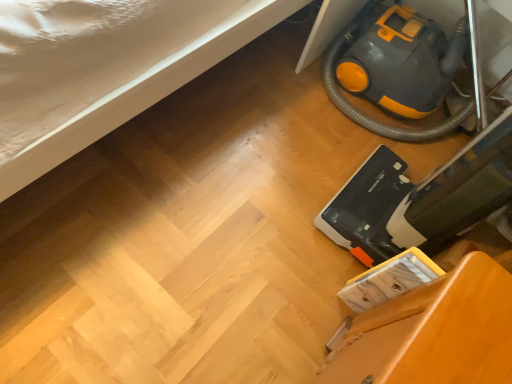
Where is `yellow-orange plastic vacuum cleaner at lower right, placed as the 1th equipment when sorted from back to front`? This screenshot has height=384, width=512. yellow-orange plastic vacuum cleaner at lower right, placed as the 1th equipment when sorted from back to front is located at coordinates (367, 115).

Identify the location of yellow-orange plastic vacuum cleaner at lower right, the first equipment viewed from the front. Image resolution: width=512 pixels, height=384 pixels. coord(420,198).

Is yellow-orange plastic vacuum cleaner at lower right, which is counted as the second equipment, starting from the front, turned away from wooden chair at lower right?

yellow-orange plastic vacuum cleaner at lower right, which is counted as the second equipment, starting from the front, does not have its back to wooden chair at lower right.

Would you say yellow-orange plastic vacuum cleaner at lower right, which is counted as the second equipment, starting from the front, is outside wooden chair at lower right?

yellow-orange plastic vacuum cleaner at lower right, which is counted as the second equipment, starting from the front, lies outside wooden chair at lower right's area.

Between yellow-orange plastic vacuum cleaner at lower right, placed as the 1th equipment when sorted from back to front, and wooden chair at lower right, which one has more height?

wooden chair at lower right is taller.

Is yellow-orange plastic vacuum cleaner at lower right, which is counted as the second equipment, starting from the front, to the left of wooden chair at lower right from the viewer's perspective?

Incorrect, yellow-orange plastic vacuum cleaner at lower right, which is counted as the second equipment, starting from the front, is not on the left side of wooden chair at lower right.

From the image's perspective, between yellow-orange plastic vacuum cleaner at lower right, the first equipment viewed from the front, and wooden chair at lower right, who is located below?

wooden chair at lower right.

Which of these two, yellow-orange plastic vacuum cleaner at lower right, the first equipment viewed from the front, or wooden chair at lower right, stands taller?

yellow-orange plastic vacuum cleaner at lower right, the first equipment viewed from the front.

Is yellow-orange plastic vacuum cleaner at lower right, the first equipment viewed from the front, aimed at wooden chair at lower right?

No, yellow-orange plastic vacuum cleaner at lower right, the first equipment viewed from the front, is not aimed at wooden chair at lower right.

From the image's perspective, count 1st equipments upward from the wooden chair at lower right and point to it. Please provide its 2D coordinates.

[(420, 198)]

Is yellow-orange plastic vacuum cleaner at lower right, the first equipment viewed from the front, placed right next to yellow-orange plastic vacuum cleaner at lower right, placed as the 1th equipment when sorted from back to front?

yellow-orange plastic vacuum cleaner at lower right, the first equipment viewed from the front, is not next to yellow-orange plastic vacuum cleaner at lower right, placed as the 1th equipment when sorted from back to front, and they're not touching.

Does yellow-orange plastic vacuum cleaner at lower right, the second equipment when ordered from back to front, contain yellow-orange plastic vacuum cleaner at lower right, placed as the 1th equipment when sorted from back to front?

Definitely not — yellow-orange plastic vacuum cleaner at lower right, placed as the 1th equipment when sorted from back to front, is not inside yellow-orange plastic vacuum cleaner at lower right, the second equipment when ordered from back to front.

Is yellow-orange plastic vacuum cleaner at lower right, the first equipment viewed from the front, facing towards yellow-orange plastic vacuum cleaner at lower right, which is counted as the second equipment, starting from the front?

No, yellow-orange plastic vacuum cleaner at lower right, the first equipment viewed from the front, is not facing towards yellow-orange plastic vacuum cleaner at lower right, which is counted as the second equipment, starting from the front.

Which is less distant, (474, 200) or (388, 135)?

Point (474, 200) is positioned closer to the camera compared to point (388, 135).

Locate an element on the screen. The image size is (512, 384). the 2nd equipment behind when counting from the wooden chair at lower right is located at coordinates (367, 115).

Based on the photo, from the image's perspective, is wooden chair at lower right below yellow-orange plastic vacuum cleaner at lower right, which is counted as the second equipment, starting from the front?

Yes.

Considering the sizes of wooden chair at lower right and yellow-orange plastic vacuum cleaner at lower right, which is counted as the second equipment, starting from the front, in the image, is wooden chair at lower right wider or thinner than yellow-orange plastic vacuum cleaner at lower right, which is counted as the second equipment, starting from the front,?

In the image, wooden chair at lower right appears to be more narrow than yellow-orange plastic vacuum cleaner at lower right, which is counted as the second equipment, starting from the front.

From the image's perspective, between yellow-orange plastic vacuum cleaner at lower right, placed as the 1th equipment when sorted from back to front, and yellow-orange plastic vacuum cleaner at lower right, the second equipment when ordered from back to front, which one is located above?

yellow-orange plastic vacuum cleaner at lower right, placed as the 1th equipment when sorted from back to front.

Is yellow-orange plastic vacuum cleaner at lower right, placed as the 1th equipment when sorted from back to front, at the right side of yellow-orange plastic vacuum cleaner at lower right, the second equipment when ordered from back to front?

Correct, you'll find yellow-orange plastic vacuum cleaner at lower right, placed as the 1th equipment when sorted from back to front, to the right of yellow-orange plastic vacuum cleaner at lower right, the second equipment when ordered from back to front.

Does point (436, 132) come in front of point (374, 157)?

No.

Between point (401, 348) and point (490, 210), which one is positioned in front?

The point (401, 348) is more forward.

Based on the photo, who is bigger, wooden chair at lower right or yellow-orange plastic vacuum cleaner at lower right, the second equipment when ordered from back to front?

yellow-orange plastic vacuum cleaner at lower right, the second equipment when ordered from back to front, is bigger.

How many degrees apart are the facing directions of wooden chair at lower right and yellow-orange plastic vacuum cleaner at lower right, the first equipment viewed from the front?

3.71 degrees separate the facing orientations of wooden chair at lower right and yellow-orange plastic vacuum cleaner at lower right, the first equipment viewed from the front.

Is wooden chair at lower right not within yellow-orange plastic vacuum cleaner at lower right, the second equipment when ordered from back to front?

Absolutely, wooden chair at lower right is external to yellow-orange plastic vacuum cleaner at lower right, the second equipment when ordered from back to front.

Where is `the 2nd equipment behind the wooden chair at lower right, counting from the anchor's position`? Image resolution: width=512 pixels, height=384 pixels. the 2nd equipment behind the wooden chair at lower right, counting from the anchor's position is located at coordinates (367, 115).

The width and height of the screenshot is (512, 384). I want to click on equipment that is the 1st object to the right of the wooden chair at lower right, starting at the anchor, so click(x=420, y=198).

From the image, which object appears to be farther from yellow-orange plastic vacuum cleaner at lower right, the second equipment when ordered from back to front, yellow-orange plastic vacuum cleaner at lower right, which is counted as the second equipment, starting from the front, or wooden chair at lower right?

yellow-orange plastic vacuum cleaner at lower right, which is counted as the second equipment, starting from the front, is positioned further to the anchor yellow-orange plastic vacuum cleaner at lower right, the second equipment when ordered from back to front.

When comparing their distances from wooden chair at lower right, does yellow-orange plastic vacuum cleaner at lower right, the second equipment when ordered from back to front, or yellow-orange plastic vacuum cleaner at lower right, which is counted as the second equipment, starting from the front, seem further?

The object further to wooden chair at lower right is yellow-orange plastic vacuum cleaner at lower right, which is counted as the second equipment, starting from the front.

Looking at the image, which one is located closer to yellow-orange plastic vacuum cleaner at lower right, which is counted as the second equipment, starting from the front, wooden chair at lower right or yellow-orange plastic vacuum cleaner at lower right, the second equipment when ordered from back to front?

Based on the image, yellow-orange plastic vacuum cleaner at lower right, the second equipment when ordered from back to front, appears to be nearer to yellow-orange plastic vacuum cleaner at lower right, which is counted as the second equipment, starting from the front.

Estimate the real-world distances between objects in this image. Which object is further from wooden chair at lower right, yellow-orange plastic vacuum cleaner at lower right, which is counted as the second equipment, starting from the front, or yellow-orange plastic vacuum cleaner at lower right, the first equipment viewed from the front?

yellow-orange plastic vacuum cleaner at lower right, which is counted as the second equipment, starting from the front, is positioned further to the anchor wooden chair at lower right.

When comparing their distances from yellow-orange plastic vacuum cleaner at lower right, the second equipment when ordered from back to front, does wooden chair at lower right or yellow-orange plastic vacuum cleaner at lower right, which is counted as the second equipment, starting from the front, seem closer?

wooden chair at lower right is closer to yellow-orange plastic vacuum cleaner at lower right, the second equipment when ordered from back to front.

When comparing their distances from yellow-orange plastic vacuum cleaner at lower right, placed as the 1th equipment when sorted from back to front, does yellow-orange plastic vacuum cleaner at lower right, the first equipment viewed from the front, or wooden chair at lower right seem further?

wooden chair at lower right lies further to yellow-orange plastic vacuum cleaner at lower right, placed as the 1th equipment when sorted from back to front, than the other object.

At what (x,y) coordinates should I click in order to perform the action: click on equipment between yellow-orange plastic vacuum cleaner at lower right, which is counted as the second equipment, starting from the front, and wooden chair at lower right in the up-down direction. Please return your answer as a coordinate pair (x, y). This screenshot has width=512, height=384. Looking at the image, I should click on (420, 198).